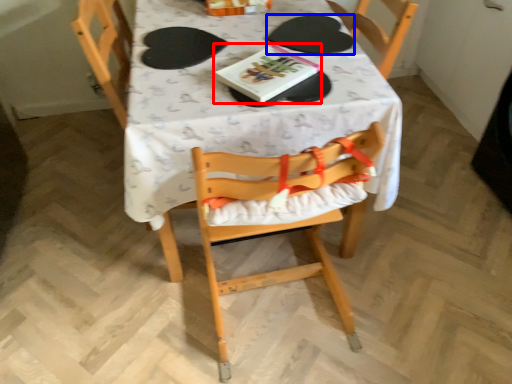
Question: Which object is further to the camera taking this photo, book (highlighted by a red box) or paper plate (highlighted by a blue box)?

Choices:
 (A) book
 (B) paper plate

Answer: (B)